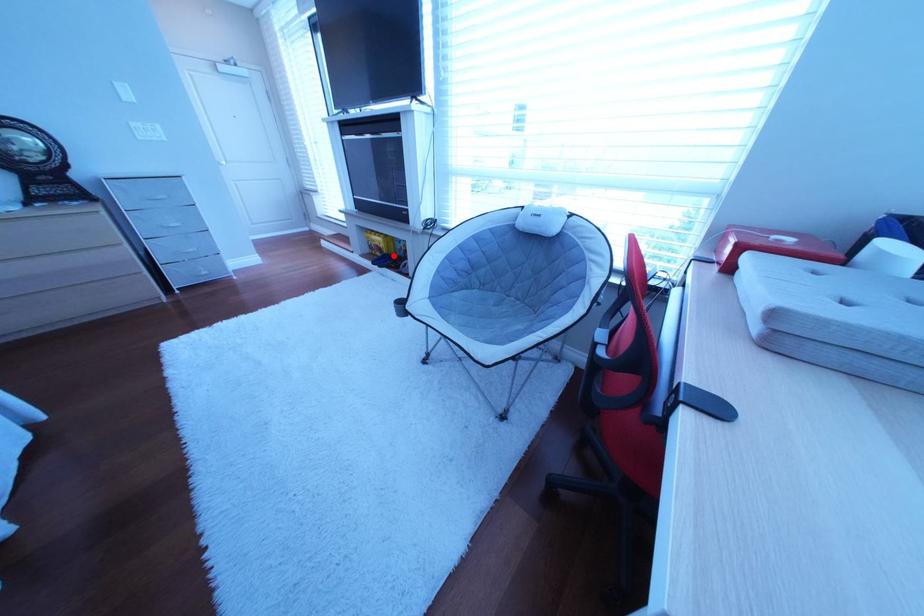
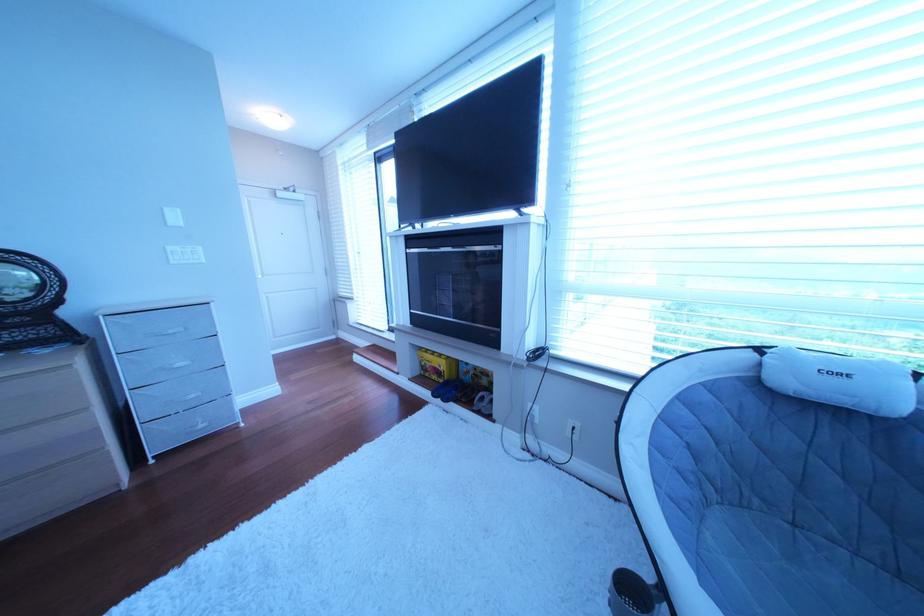
The point at the highlighted location is marked in the first image. Where is the corresponding point in the second image?

(450, 379)